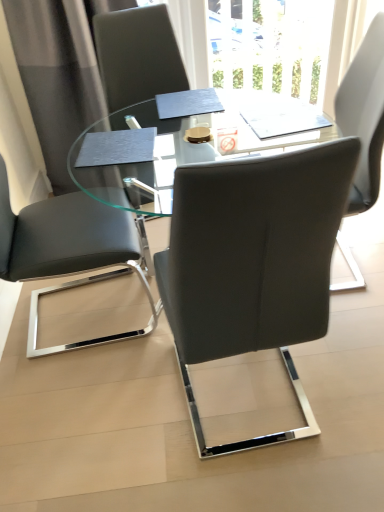
Question: Is transparent glass table at center positioned beyond the bounds of matte black chair at left, acting as the 2th chair starting from the right?

Choices:
 (A) no
 (B) yes

Answer: (B)

Question: From the image's perspective, would you say transparent glass table at center is shown under matte black chair at left, the 1th chair when ordered from left to right?

Choices:
 (A) yes
 (B) no

Answer: (A)

Question: Does transparent glass table at center come in front of matte black chair at left, the 1th chair when ordered from left to right?

Choices:
 (A) no
 (B) yes

Answer: (A)

Question: Is transparent glass table at center to the left of matte black chair at left, acting as the 2th chair starting from the right, from the viewer's perspective?

Choices:
 (A) no
 (B) yes

Answer: (A)

Question: From a real-world perspective, is transparent glass table at center under matte black chair at left, acting as the 2th chair starting from the right?

Choices:
 (A) yes
 (B) no

Answer: (A)

Question: From a real-world perspective, relative to gray fabric curtain at upper left, is transparent glass table at center vertically above or below?

Choices:
 (A) above
 (B) below

Answer: (B)

Question: Would you say transparent glass table at center is inside or outside gray fabric curtain at upper left?

Choices:
 (A) inside
 (B) outside

Answer: (B)

Question: In terms of size, does transparent glass table at center appear bigger or smaller than gray fabric curtain at upper left?

Choices:
 (A) small
 (B) big

Answer: (B)

Question: In terms of width, does transparent glass table at center look wider or thinner when compared to gray fabric curtain at upper left?

Choices:
 (A) thin
 (B) wide

Answer: (B)

Question: From a real-world perspective, is transparent glass table at center positioned above or below matte gray chair at center, which is the second chair in left-to-right order?

Choices:
 (A) below
 (B) above

Answer: (A)

Question: From their relative heights in the image, would you say transparent glass table at center is taller or shorter than matte gray chair at center, which is the second chair in left-to-right order?

Choices:
 (A) short
 (B) tall

Answer: (A)

Question: Which is correct: transparent glass table at center is inside matte gray chair at center, which is the second chair in left-to-right order, or outside of it?

Choices:
 (A) outside
 (B) inside

Answer: (A)

Question: Looking at the image, does transparent glass table at center seem bigger or smaller compared to matte gray chair at center, which is the 1th chair from right to left?

Choices:
 (A) small
 (B) big

Answer: (B)

Question: Choose the correct answer: Is gray fabric curtain at upper left inside matte black chair at left, the 1th chair when ordered from left to right, or outside it?

Choices:
 (A) inside
 (B) outside

Answer: (B)

Question: From the image's perspective, is gray fabric curtain at upper left located above or below matte black chair at left, acting as the 2th chair starting from the right?

Choices:
 (A) below
 (B) above

Answer: (B)